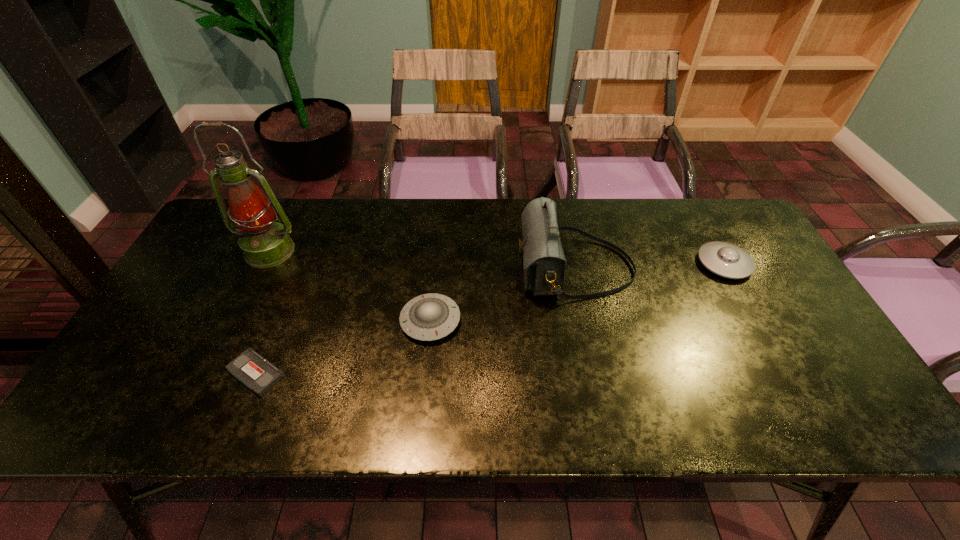
Identify the location of empty space between the oil lamp and the rightmost object. This screenshot has width=960, height=540. [497, 258].

Where is `empty space between the nearer saucer and the tallest object`? The image size is (960, 540). empty space between the nearer saucer and the tallest object is located at coordinates (350, 286).

Identify the location of free space between the oil lamp and the nearest object. This screenshot has width=960, height=540. (x=263, y=312).

The width and height of the screenshot is (960, 540). I want to click on blank region between the fourth shortest object and the third shortest object, so pyautogui.click(x=650, y=266).

Locate an element on the screen. free spot between the tallest object and the second shortest object is located at coordinates (350, 286).

Locate which object ranks third in proximity to the fourth shortest object. Please provide its 2D coordinates. Your answer should be formatted as a tuple, i.e. [(x, y)], where the tuple contains the x and y coordinates of a point satisfying the conditions above.

[(253, 370)]

This screenshot has width=960, height=540. I want to click on object that ranks as the second closest to the shorter saucer, so click(253, 370).

Locate an element on the screen. free point that satisfies the following two spatial constraints: 1. on the front side of the oil lamp; 2. on the left side of the nearer saucer is located at coordinates (236, 320).

The width and height of the screenshot is (960, 540). Identify the location of vacant area in the image that satisfies the following two spatial constraints: 1. on the back side of the shorter saucer; 2. on the left side of the videotape. (277, 320).